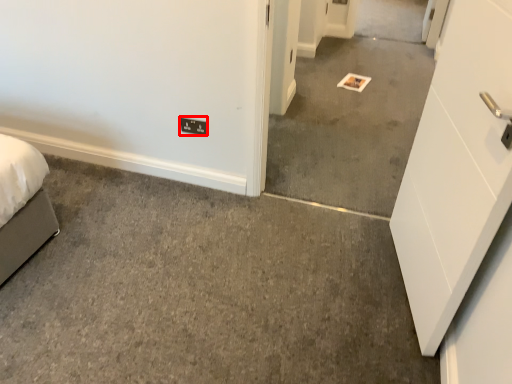
Question: From the image's perspective, considering the relative positions of light switch (annotated by the red box) and concrete in the image provided, where is light switch (annotated by the red box) located with respect to the staircase?

Choices:
 (A) above
 (B) below

Answer: (B)